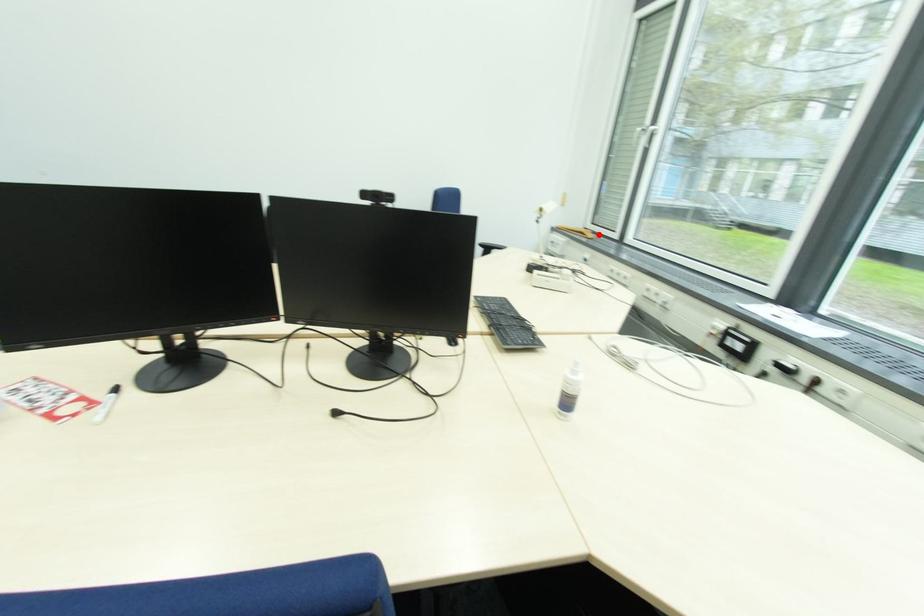
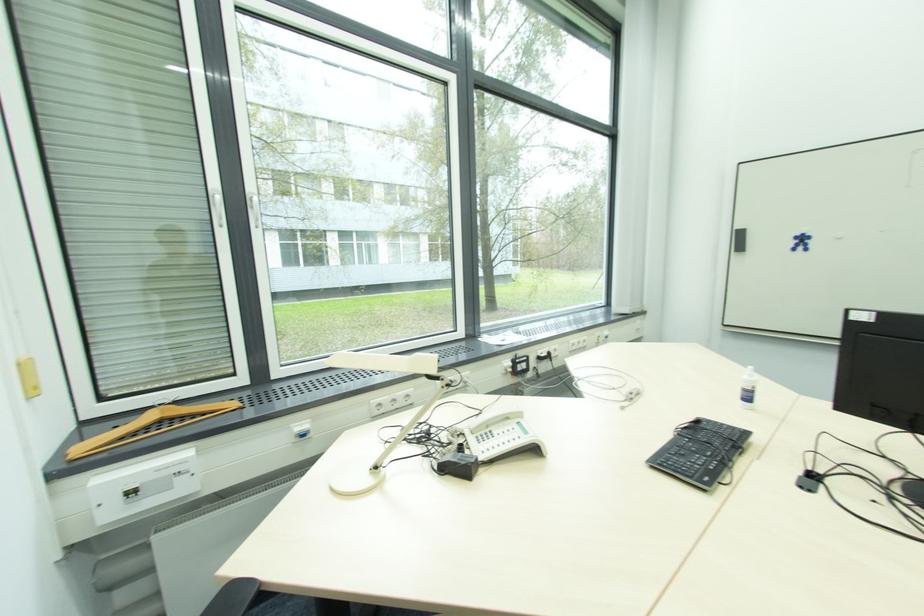
Locate, in the second image, the point that corresponds to the highlighted location in the first image.

(179, 406)